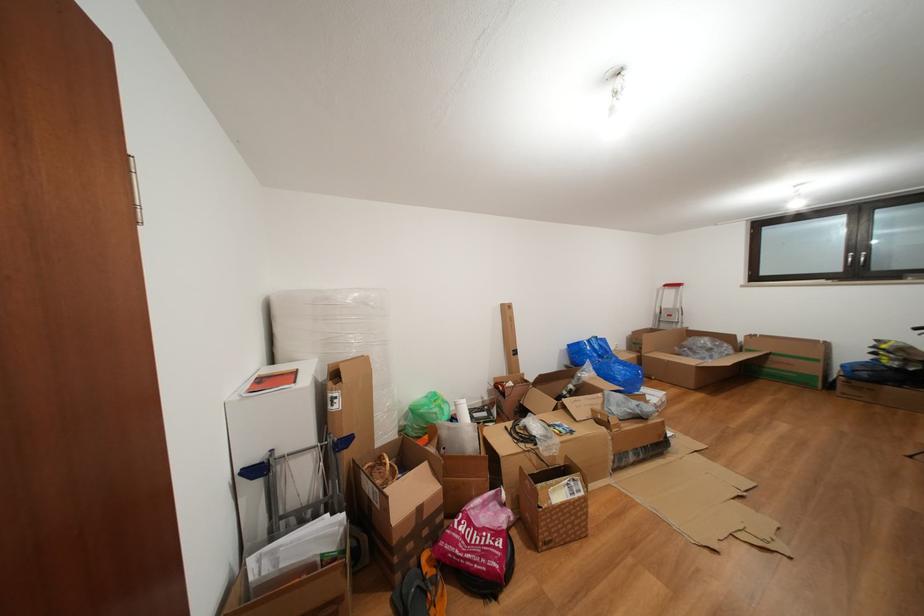
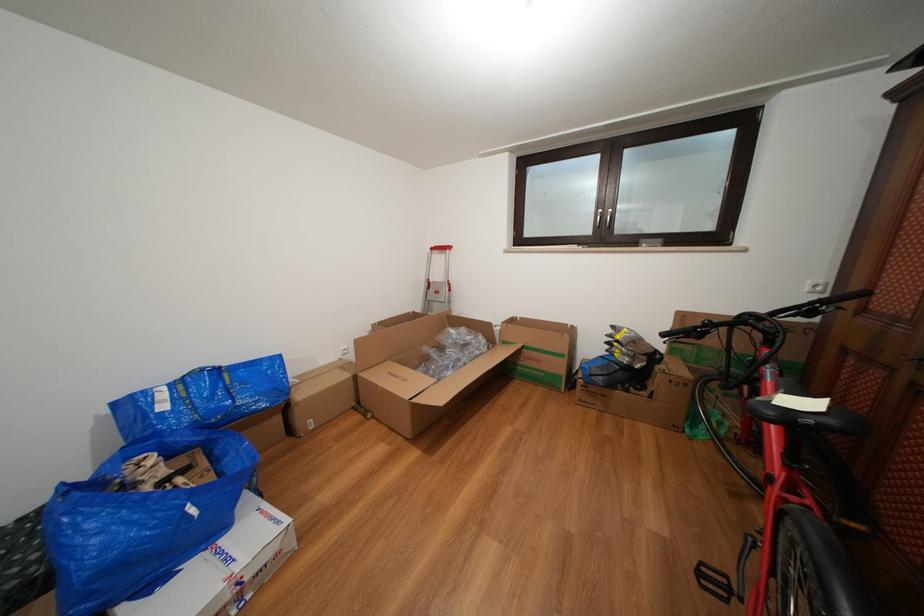
Locate, in the second image, the point that corresponds to (674,291) in the first image.

(441, 254)